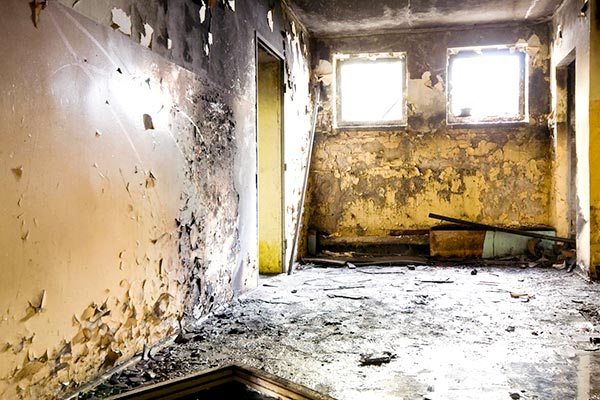
Find the location of a particular element. The image size is (600, 400). window is located at coordinates (502, 83), (383, 83).